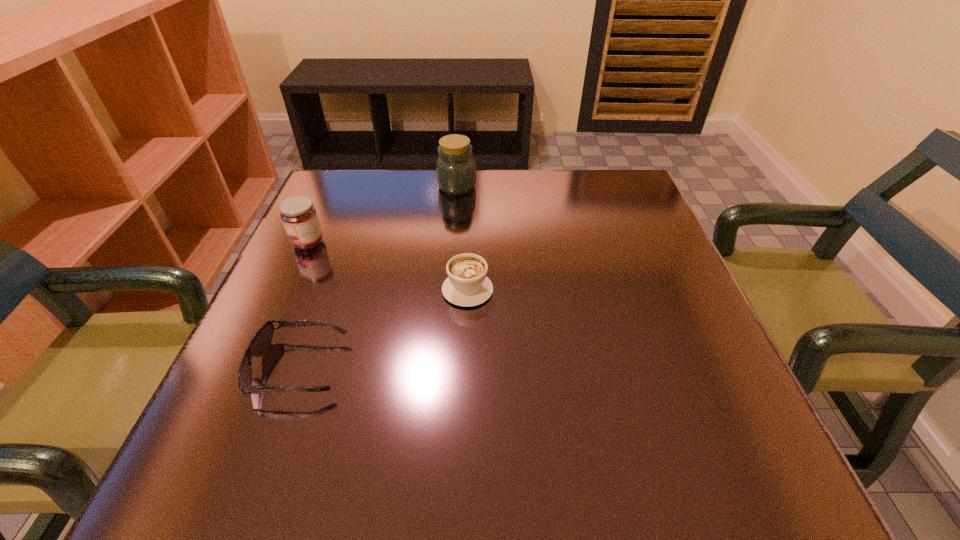
Find the location of `blank space at the right edge`. blank space at the right edge is located at coordinates (605, 222).

Locate an element on the screen. The width and height of the screenshot is (960, 540). vacant space at the far left corner of the desktop is located at coordinates (357, 219).

Where is `free point between the third tallest object and the farthest object`? The height and width of the screenshot is (540, 960). free point between the third tallest object and the farthest object is located at coordinates (462, 238).

I want to click on free space between the second nearest object and the sunglasses, so click(383, 328).

The height and width of the screenshot is (540, 960). What are the coordinates of `empty space that is in between the farthest object and the nearest object` in the screenshot? It's located at (378, 277).

This screenshot has width=960, height=540. Find the location of `free space between the shortest object and the third shortest object`. free space between the shortest object and the third shortest object is located at coordinates (303, 305).

Identify the location of vacant space that is in between the cappuccino and the jar. (462, 238).

Locate an element on the screen. vacant area between the jar and the nearest object is located at coordinates (378, 277).

I want to click on free space between the farthest object and the jam, so click(382, 214).

You are a GUI agent. You are given a task and a screenshot of the screen. Output one action in this format:
    pyautogui.click(x=<x>, y=<y>)
    Task: Click on the vacant space that's between the farthest object and the third farthest object
    This screenshot has width=960, height=540.
    Given the screenshot: What is the action you would take?
    pyautogui.click(x=462, y=238)